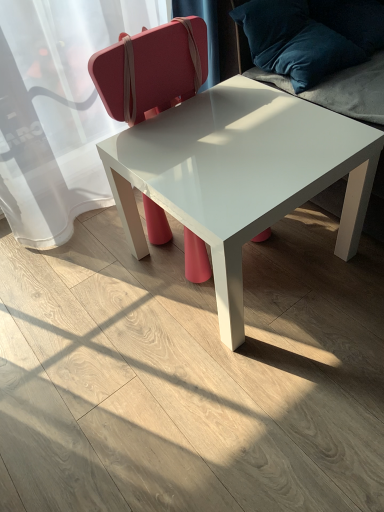
Locate an element on the screen. The height and width of the screenshot is (512, 384). free location in front of matte pink suitcase at center is located at coordinates (205, 328).